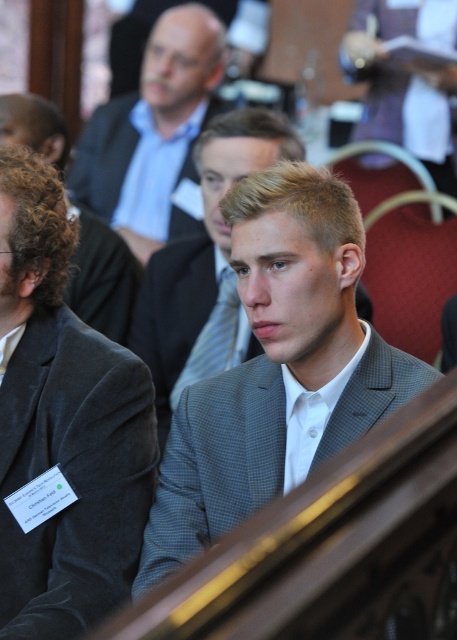
You are an event organizer who needs to arrange seating for a photo. You see the dark gray suit at center and the matte gray suit at center. Which one is closer to the camera?

The dark gray suit at center is positioned under the matte gray suit at center, so the matte gray suit at center is closer to the camera.

You are organizing a photo shoot for a men clothing brand and need to arrange two suits in the center of the frame. The suits are labeled as dark gray suit at center and matte gray suit at center. Given their spatial requirements, which suit should be placed first to ensure both fit within the frame?

The dark gray suit at center occupies less space than matte gray suit at center, so you should place the dark gray suit at center first to ensure both fit within the frame.